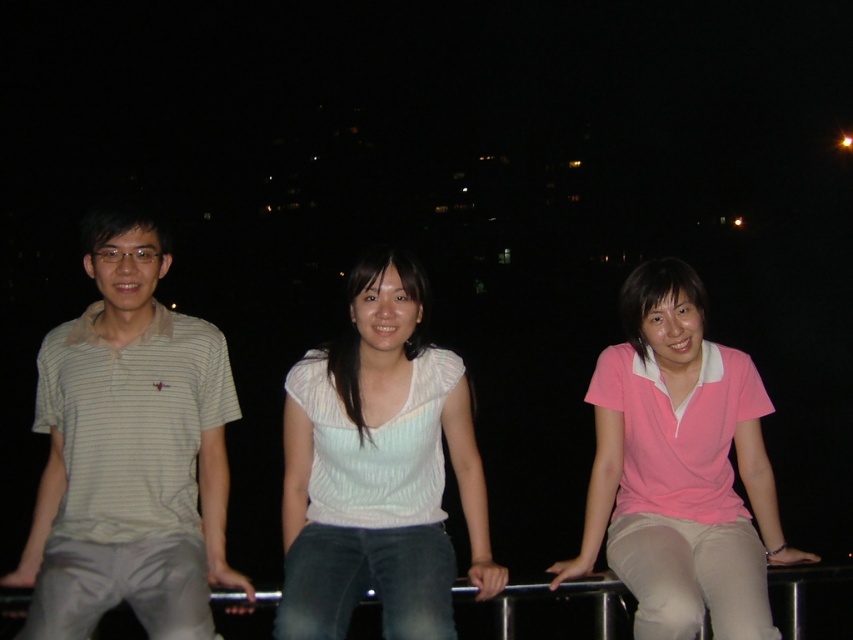
You are a photographer trying to capture a group photo of the white striped shirt at left and the white matte shirt at center. Since you want to ensure both subjects are in focus, you need to know their heights. Which of the two is taller?

The white striped shirt at left is much taller than the white matte shirt at center, so the photographer should adjust the camera angle to account for the height difference to ensure both are in focus.

You are a photographer trying to capture a candid shot of the white striped shirt at left and the pink matte shirt at center. Since you want to include both in the frame, which direction should you position your camera relative to the subjects?

The white striped shirt at left is to the left of the pink matte shirt at center. To capture both in the frame, position your camera to the right side of the pink matte shirt at center so that both subjects are visible.

You are standing at the point with coordinates point (354,448) and want to move towards the point with coordinates point (21,632). Given that the railing they are sitting on is straight, which direction should you move relative to your current position?

You should move forward because point (21,632) is in front of point (354,448).